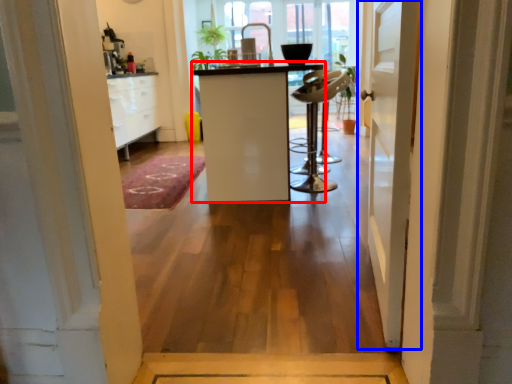
Question: Which object is closer to the camera taking this photo, furniture (highlighted by a red box) or door (highlighted by a blue box)?

Choices:
 (A) furniture
 (B) door

Answer: (B)